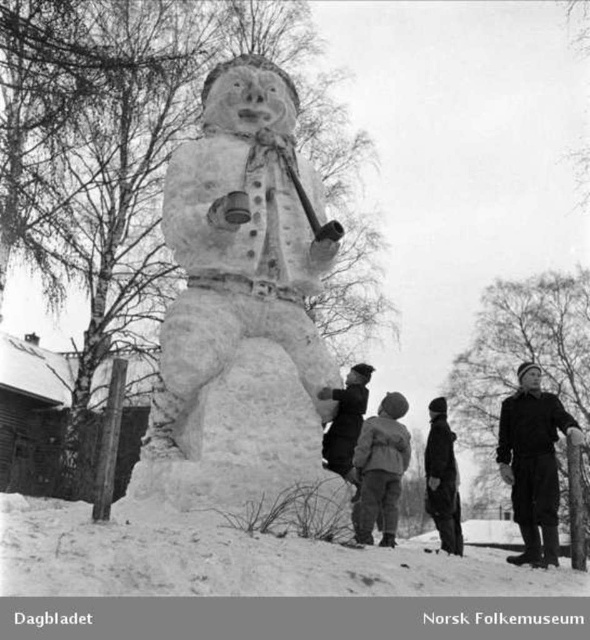
Question: Is white snowman at center positioned at the back of white fluffy snow at lower center?

Choices:
 (A) no
 (B) yes

Answer: (B)

Question: Estimate the real-world distances between objects in this image. Which object is farther from the dark gray wool sweater at center?

Choices:
 (A) dark gray woolen hat at upper right
 (B) light gray woolen jacket at center
 (C) white fluffy snow at lower center
 (D) dark woolen coat at center

Answer: (C)

Question: Which object appears farthest from the camera in this image?

Choices:
 (A) dark gray woolen hat at upper right
 (B) light gray woolen jacket at center
 (C) white fluffy snow at lower center

Answer: (C)

Question: Which point is closer to the camera?

Choices:
 (A) dark gray wool sweater at center
 (B) white fluffy snow at lower center

Answer: (B)

Question: Is white snowman at center positioned before white fluffy snow at lower center?

Choices:
 (A) yes
 (B) no

Answer: (B)

Question: Is white snowman at center to the left of dark gray woolen hat at upper right from the viewer's perspective?

Choices:
 (A) no
 (B) yes

Answer: (B)